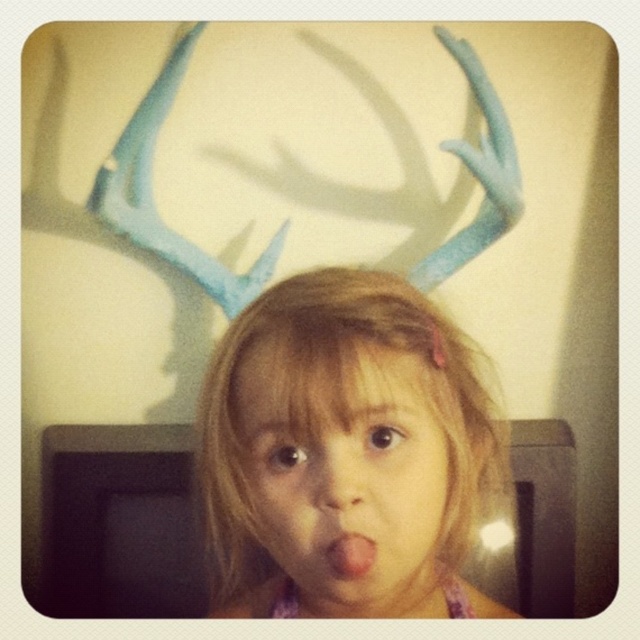
You are a photographer setting up for a child portrait. The child has two hair accessories, a blonde hair at center and a matte pink hair at center. You need to ensure that both accessories are visible in the frame. Given that your camera has a minimum focus distance of 3 inches, will both accessories be in focus if they are positioned exactly as shown?

The distance between the blonde hair at center and matte pink hair at center is 3.45 inches, which exceeds the camera minimum focus distance of 3 inches. Therefore, both accessories will be in focus.

The child in the image has a playful expression and is wearing blue antlers. Where exactly is the child standing in relation to the point marked at coordinates (x=349, y=436)?

The point at coordinates (x=349, y=436) indicates the location of the blonde hair at center, so the child is standing such that their blonde hair is precisely at that point.

Looking at the child in the image, which object is positioned to the right of the other between the matte pink hair at center and the pink matte tongue at center?

The matte pink hair at center is positioned to the right of the pink matte tongue at center.